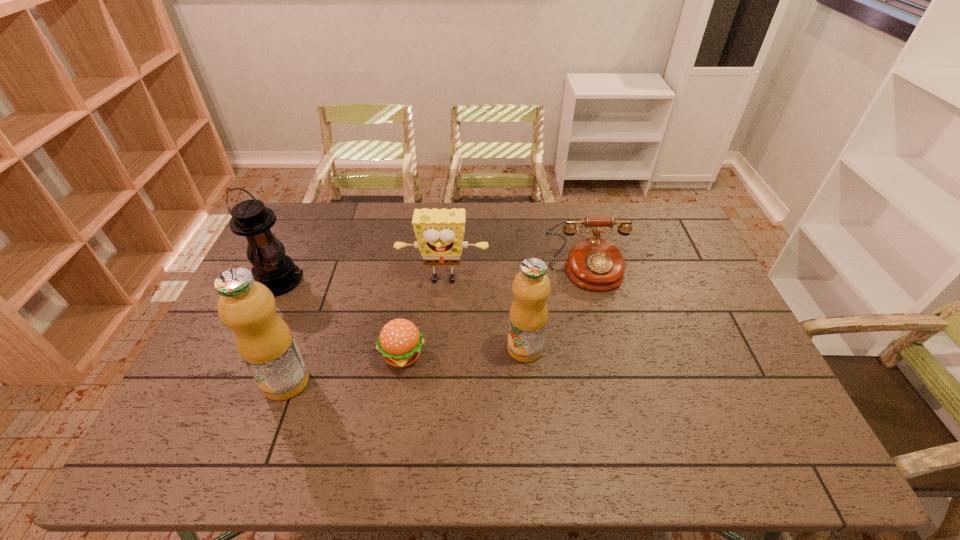
In the image, there is a desktop. At what (x,y) coordinates should I click in order to perform the action: click on vacant region at the far right corner. Please return your answer as a coordinate pair (x, y). Image resolution: width=960 pixels, height=540 pixels. Looking at the image, I should click on (658, 205).

At what (x,y) coordinates should I click in order to perform the action: click on vacant region between the lantern and the right fruit juice. Please return your answer as a coordinate pair (x, y). Looking at the image, I should click on (402, 315).

Identify the location of free space between the telephone and the fourth tallest object. This screenshot has height=540, width=960. (515, 276).

At what (x,y) coordinates should I click in order to perform the action: click on empty space between the telephone and the left fruit juice. Please return your answer as a coordinate pair (x, y). The image size is (960, 540). Looking at the image, I should click on (437, 327).

Where is `empty space that is in between the lantern and the third shortest object`? empty space that is in between the lantern and the third shortest object is located at coordinates (362, 281).

Identify the location of free space between the taller fruit juice and the shortest object. (345, 368).

I want to click on unoccupied position between the left fruit juice and the rightmost object, so click(x=437, y=327).

The width and height of the screenshot is (960, 540). I want to click on blank region between the hamburger and the rightmost object, so click(x=494, y=313).

You are a GUI agent. You are given a task and a screenshot of the screen. Output one action in this format:
    pyautogui.click(x=<x>, y=<y>)
    Task: Click on the object that stands as the fifth closest to the rightmost object
    This screenshot has height=540, width=960.
    Given the screenshot: What is the action you would take?
    pyautogui.click(x=250, y=218)

Identify which object is the second nearest to the sponge. Please provide its 2D coordinates. Your answer should be formatted as a tuple, i.e. [(x, y)], where the tuple contains the x and y coordinates of a point satisfying the conditions above.

[(531, 287)]